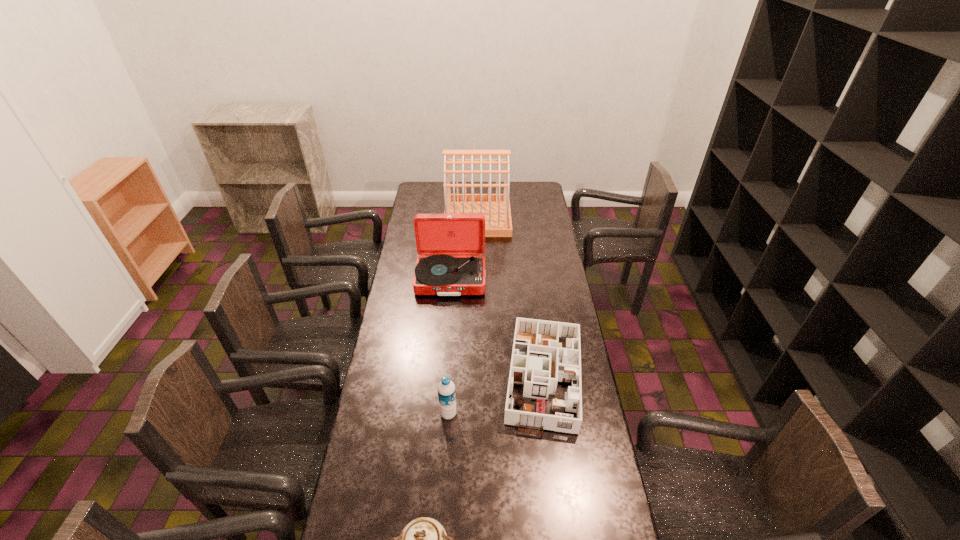
At what (x,y) coordinates should I click in order to perform the action: click on object that is at the far edge. Please return your answer as a coordinate pair (x, y). The height and width of the screenshot is (540, 960). Looking at the image, I should click on (495, 207).

Where is `object at the left edge`? This screenshot has height=540, width=960. object at the left edge is located at coordinates (451, 246).

The width and height of the screenshot is (960, 540). In order to click on object located at the right edge in this screenshot , I will do `click(538, 361)`.

Where is `free region at the far edge of the desktop`? This screenshot has width=960, height=540. free region at the far edge of the desktop is located at coordinates (492, 183).

Locate an element on the screen. blank area at the left edge is located at coordinates (357, 539).

Locate an element on the screen. Image resolution: width=960 pixels, height=540 pixels. free region at the right edge of the desktop is located at coordinates (534, 211).

In the image, there is a desktop. What are the coordinates of `vacant space at the far left corner` in the screenshot? It's located at (433, 186).

The height and width of the screenshot is (540, 960). I want to click on vacant area at the far right corner of the desktop, so click(x=537, y=201).

Locate an element on the screen. This screenshot has width=960, height=540. free space between the third tallest object and the birdcage is located at coordinates (463, 316).

At what (x,y) coordinates should I click in order to perform the action: click on vacant space that's between the dollhouse and the water bottle. Please return your answer as a coordinate pair (x, y). Image resolution: width=960 pixels, height=540 pixels. Looking at the image, I should click on (496, 394).